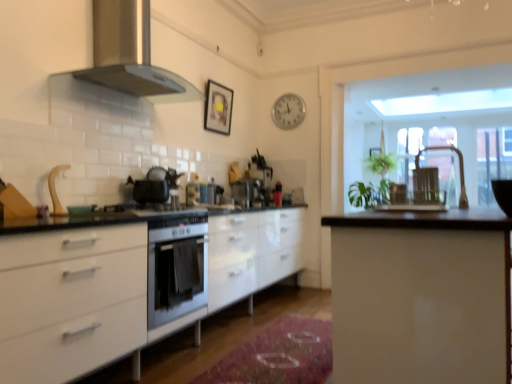
Question: Is rug at center to the right of white plastic clock at upper center from the viewer's perspective?

Choices:
 (A) no
 (B) yes

Answer: (A)

Question: From a real-world perspective, is rug at center positioned over white plastic clock at upper center based on gravity?

Choices:
 (A) no
 (B) yes

Answer: (A)

Question: Is rug at center oriented towards white plastic clock at upper center?

Choices:
 (A) yes
 (B) no

Answer: (B)

Question: Can you confirm if rug at center is taller than white plastic clock at upper center?

Choices:
 (A) yes
 (B) no

Answer: (B)

Question: Is rug at center not within white plastic clock at upper center?

Choices:
 (A) yes
 (B) no

Answer: (A)

Question: From the image's perspective, does rug at center appear lower than white plastic clock at upper center?

Choices:
 (A) yes
 (B) no

Answer: (A)

Question: Is clear glass door at upper right at the left side of matte black gas stove at center?

Choices:
 (A) yes
 (B) no

Answer: (B)

Question: Is clear glass door at upper right not near matte black gas stove at center?

Choices:
 (A) no
 (B) yes

Answer: (B)

Question: Considering the relative sizes of clear glass door at upper right and matte black gas stove at center in the image provided, is clear glass door at upper right smaller than matte black gas stove at center?

Choices:
 (A) yes
 (B) no

Answer: (B)

Question: Considering the relative sizes of clear glass door at upper right and matte black gas stove at center in the image provided, is clear glass door at upper right thinner than matte black gas stove at center?

Choices:
 (A) yes
 (B) no

Answer: (A)

Question: Is clear glass door at upper right in front of matte black gas stove at center?

Choices:
 (A) yes
 (B) no

Answer: (B)

Question: Does clear glass door at upper right have a larger size compared to matte black gas stove at center?

Choices:
 (A) yes
 (B) no

Answer: (A)

Question: Is matte black kettle at right, which is counted as the second appliance, starting from the back, next to satin black coffee machine at center, which is the 1th coffee machine from back to front, and touching it?

Choices:
 (A) yes
 (B) no

Answer: (B)